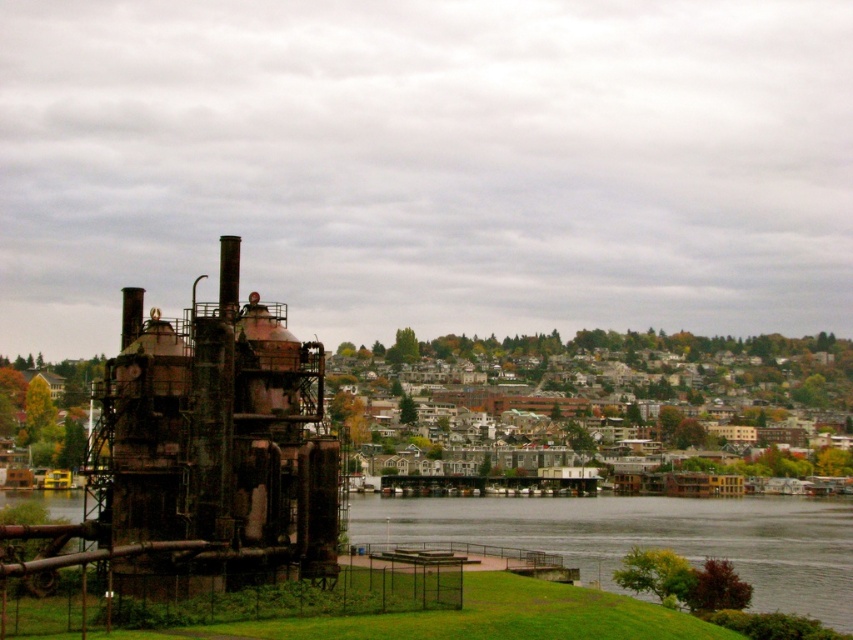
Question: In this image, where is rusty metal structure at left located relative to dark gray water at lower center?

Choices:
 (A) right
 (B) left

Answer: (B)

Question: Which point is closer to the camera taking this photo?

Choices:
 (A) (505, 515)
 (B) (372, 352)

Answer: (A)

Question: Which of these objects is positioned farthest from the dark gray water at lower center?

Choices:
 (A) rusty metal structure at left
 (B) rusty metal industrial structure at left

Answer: (B)

Question: Is rusty metal industrial structure at left closer to camera compared to dark gray water at lower center?

Choices:
 (A) no
 (B) yes

Answer: (A)

Question: Is rusty metal structure at left wider than dark gray water at lower center?

Choices:
 (A) yes
 (B) no

Answer: (B)

Question: Which object is positioned farthest from the rusty metal structure at left?

Choices:
 (A) rusty metal industrial structure at left
 (B) dark gray water at lower center

Answer: (A)